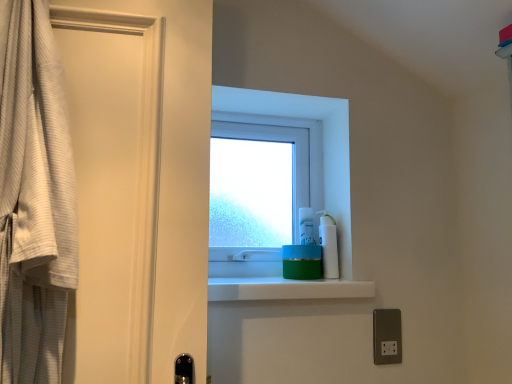
Describe the element at coordinates (286, 289) in the screenshot. The width and height of the screenshot is (512, 384). I see `green matte jar at center` at that location.

What do you see at coordinates (387, 336) in the screenshot?
I see `metallic silver outlet at lower right` at bounding box center [387, 336].

At what (x,y) coordinates should I click in order to perform the action: click on transparent plastic window at center. Please return your answer as a coordinate pair (x, y). The width and height of the screenshot is (512, 384). Looking at the image, I should click on (310, 146).

Considering their positions, is metallic silver outlet at lower right located in front of or behind transparent plastic window at center?

metallic silver outlet at lower right is positioned closer to the viewer than transparent plastic window at center.

Can we say metallic silver outlet at lower right lies outside transparent plastic window at center?

Absolutely, metallic silver outlet at lower right is external to transparent plastic window at center.

Considering the sizes of objects metallic silver outlet at lower right and transparent plastic window at center in the image provided, who is taller, metallic silver outlet at lower right or transparent plastic window at center?

transparent plastic window at center.

Is metallic silver outlet at lower right aimed at transparent plastic window at center?

No, metallic silver outlet at lower right does not turn towards transparent plastic window at center.

Based on the photo, which is more to the right, transparent plastic window at center or white textured robe at left?

Positioned to the right is transparent plastic window at center.

Is transparent plastic window at center aimed at white textured robe at left?

No.

Which of these two, transparent plastic window at center or white textured robe at left, is thinner?

Thinner between the two is transparent plastic window at center.

Identify the location of window above the white textured robe at left (from a real-world perspective). (310, 146).

Is white textured robe at left far away from metallic silver outlet at lower right?

No, white textured robe at left is in close proximity to metallic silver outlet at lower right.

In order to click on electric outlet lying below the white textured robe at left (from the image's perspective) in this screenshot , I will do `click(387, 336)`.

Is white textured robe at left at the right side of metallic silver outlet at lower right?

No.

In the scene shown: From a real-world perspective, is white textured robe at left physically below metallic silver outlet at lower right?

Incorrect, from a real-world perspective, white textured robe at left is higher than metallic silver outlet at lower right.

Is green matte jar at center facing towards metallic silver outlet at lower right?

No.

Can you confirm if green matte jar at center is smaller than metallic silver outlet at lower right?

No.

Would you say green matte jar at center is to the left or to the right of metallic silver outlet at lower right in the picture?

Based on their positions, green matte jar at center is located to the left of metallic silver outlet at lower right.

Is transparent plastic window at center wider or thinner than metallic silver outlet at lower right?

Clearly, transparent plastic window at center has more width compared to metallic silver outlet at lower right.

Does point (314, 102) appear closer or farther from the camera than point (380, 346)?

Point (314, 102) is positioned farther from the camera compared to point (380, 346).

Is transparent plastic window at center smaller than metallic silver outlet at lower right?

No.

Locate an element on the screen. The image size is (512, 384). balustrade below the transparent plastic window at center (from the image's perspective) is located at coordinates (286, 289).

Does transparent plastic window at center have a lesser height compared to green matte jar at center?

Incorrect, the height of transparent plastic window at center does not fall short of that of green matte jar at center.

From the image's perspective, who appears lower, transparent plastic window at center or green matte jar at center?

green matte jar at center.

Does transparent plastic window at center have a larger size compared to white plastic pump bottle at upper right?

Yes.

From the image's perspective, is transparent plastic window at center above white plastic pump bottle at upper right?

Yes, from the image's perspective, transparent plastic window at center is above white plastic pump bottle at upper right.

In the scene shown: How different are the orientations of transparent plastic window at center and white plastic pump bottle at upper right in degrees?

The angle between the facing direction of transparent plastic window at center and the facing direction of white plastic pump bottle at upper right is 0.000148 degrees.

Is transparent plastic window at center thinner than white plastic pump bottle at upper right?

In fact, transparent plastic window at center might be wider than white plastic pump bottle at upper right.

Image resolution: width=512 pixels, height=384 pixels. In order to click on window lying above the metallic silver outlet at lower right (from the image's perspective) in this screenshot , I will do `click(310, 146)`.

Where is `curtain directly beneath the transparent plastic window at center (from a real-world perspective)`? This screenshot has width=512, height=384. curtain directly beneath the transparent plastic window at center (from a real-world perspective) is located at coordinates (34, 198).

From the image, which object appears to be farther from white plastic pump bottle at upper right, green matte jar at center or transparent plastic window at center?

transparent plastic window at center lies further to white plastic pump bottle at upper right than the other object.

When comparing their distances from white textured robe at left, does white plastic pump bottle at upper right or metallic silver outlet at lower right seem further?

metallic silver outlet at lower right is positioned further to the anchor white textured robe at left.

Based on their spatial positions, is green matte jar at center or metallic silver outlet at lower right further from white plastic pump bottle at upper right?

Among the two, metallic silver outlet at lower right is located further to white plastic pump bottle at upper right.

Looking at the image, which one is located further to white textured robe at left, metallic silver outlet at lower right or transparent plastic window at center?

metallic silver outlet at lower right lies further to white textured robe at left than the other object.

Considering their positions, is metallic silver outlet at lower right positioned closer to white plastic pump bottle at upper right than white textured robe at left?

metallic silver outlet at lower right is closer to white plastic pump bottle at upper right.

In the scene shown: Considering their positions, is white plastic pump bottle at upper right positioned further to green matte jar at center than white textured robe at left?

white textured robe at left lies further to green matte jar at center than the other object.

Looking at the image, which one is located closer to white textured robe at left, transparent plastic window at center or metallic silver outlet at lower right?

transparent plastic window at center.

Based on their spatial positions, is white textured robe at left or metallic silver outlet at lower right closer to white plastic pump bottle at upper right?

Among the two, metallic silver outlet at lower right is located nearer to white plastic pump bottle at upper right.

Identify the location of cleaning product that lies between transparent plastic window at center and metallic silver outlet at lower right from top to bottom. (328, 245).

Identify the location of balustrade located between white textured robe at left and metallic silver outlet at lower right in the left-right direction. (286, 289).

What are the coordinates of `cleaning product between white textured robe at left and metallic silver outlet at lower right in the horizontal direction` in the screenshot? It's located at (328, 245).

Find the location of a particular element. The height and width of the screenshot is (384, 512). balustrade between white textured robe at left and white plastic pump bottle at upper right is located at coordinates (286, 289).